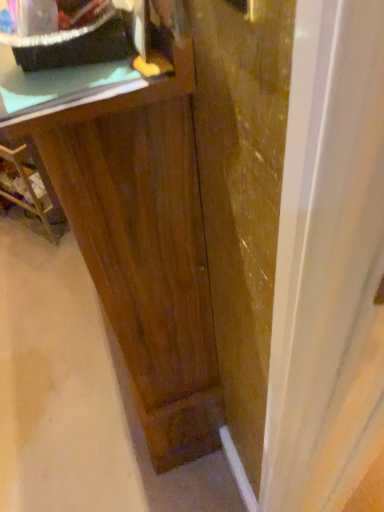
Question: Which is correct: transparent glass door at center is inside dark wood cabinet at left, or outside of it?

Choices:
 (A) inside
 (B) outside

Answer: (B)

Question: Considering the positions of point (339, 323) and point (59, 217), is point (339, 323) closer or farther from the camera than point (59, 217)?

Choices:
 (A) closer
 (B) farther

Answer: (A)

Question: Which object is the closest to the dark wood cabinet at left?

Choices:
 (A) transparent glass door at center
 (B) matte black tray at upper left
 (C) metallic gold door handle at upper right
 (D) green matte counter top at upper left
 (E) dark wood vanity at center

Answer: (E)

Question: Which object is positioned farthest from the green matte counter top at upper left?

Choices:
 (A) transparent glass door at center
 (B) dark wood cabinet at left
 (C) matte black tray at upper left
 (D) metallic gold door handle at upper right
 (E) dark wood vanity at center

Answer: (B)